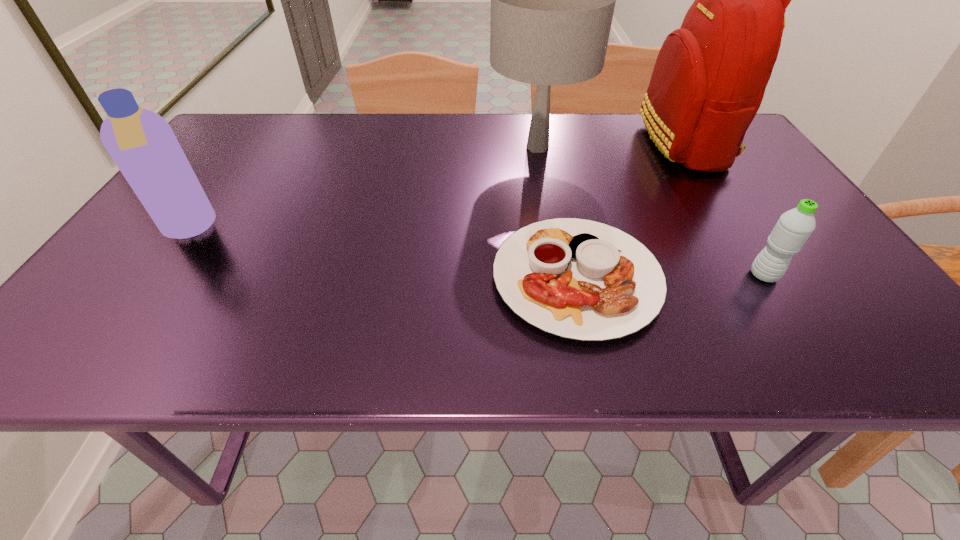
This screenshot has width=960, height=540. Find the location of `water bottle present at the right edge`. water bottle present at the right edge is located at coordinates (794, 227).

Where is `object that is at the far right corner`? The image size is (960, 540). object that is at the far right corner is located at coordinates (709, 79).

In the image, there is a desktop. Where is `vacant space at the far edge`? vacant space at the far edge is located at coordinates (526, 130).

In the image, there is a desktop. Where is `vacant space at the near edge`? Image resolution: width=960 pixels, height=540 pixels. vacant space at the near edge is located at coordinates (420, 336).

The width and height of the screenshot is (960, 540). I want to click on vacant space at the left edge of the desktop, so click(x=216, y=175).

Find the location of a particular element. The width and height of the screenshot is (960, 540). free region at the right edge of the desktop is located at coordinates (730, 200).

You are a GUI agent. You are given a task and a screenshot of the screen. Output one action in this format:
    pyautogui.click(x=<x>, y=<y>)
    Task: Click on the free region at the near right corner
    This screenshot has width=960, height=540.
    Given the screenshot: What is the action you would take?
    912,351

Locate an element on the screen. The image size is (960, 540). vacant area that lies between the shampoo and the tallest object is located at coordinates (436, 186).

Identify the location of vacant region between the backpack and the third tallest object. The width and height of the screenshot is (960, 540). (436, 186).

Identify the location of free area in between the backpack and the fourth tallest object. The image size is (960, 540). (724, 209).